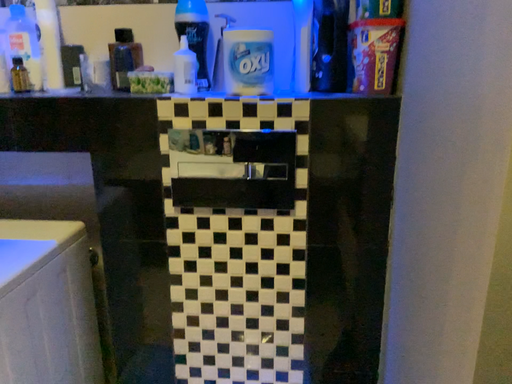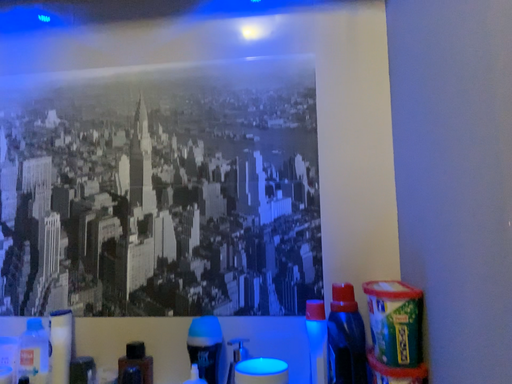
Question: Which way did the camera rotate in the video?

Choices:
 (A) rotated upward
 (B) rotated downward

Answer: (A)